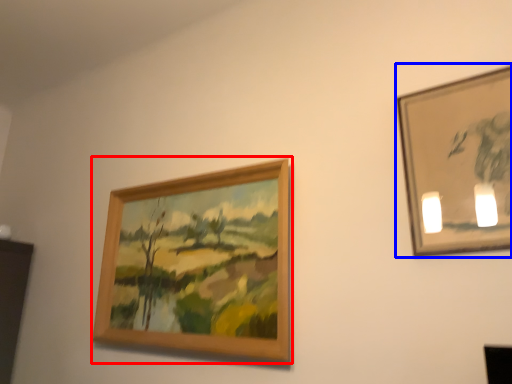
Question: Which of the following is the closest to the observer, picture frame (highlighted by a red box) or picture frame (highlighted by a blue box)?

Choices:
 (A) picture frame
 (B) picture frame

Answer: (B)